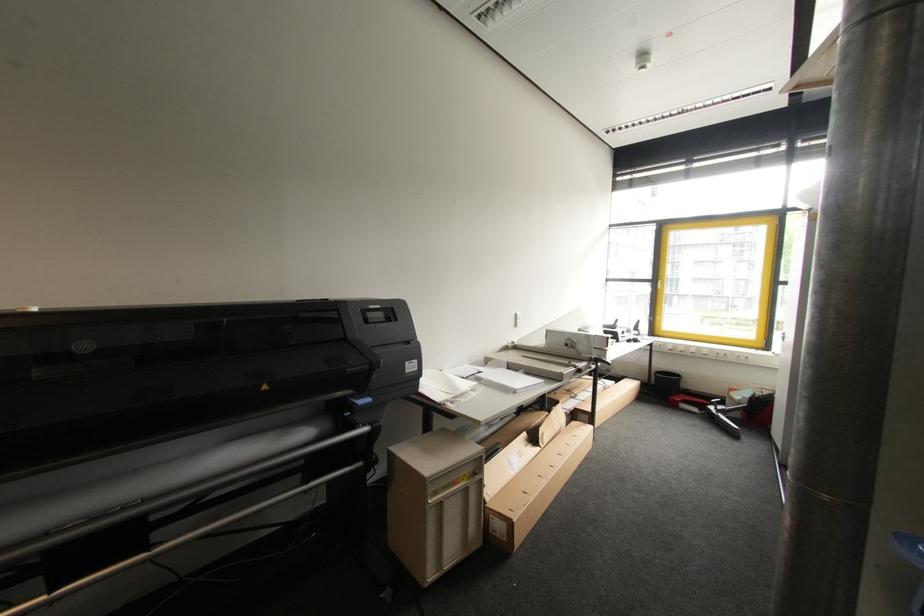
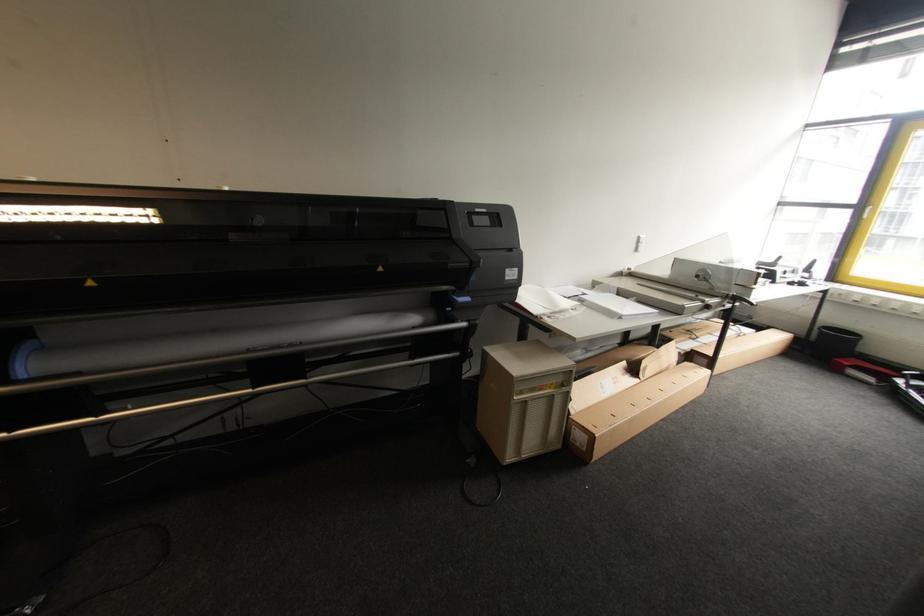
Question: The camera is either moving clockwise (left) or counter-clockwise (right) around the object. The first image is from the beginning of the video and the second image is from the end. Is the camera moving left or right when shooting the video?

Choices:
 (A) Left
 (B) Right

Answer: (B)